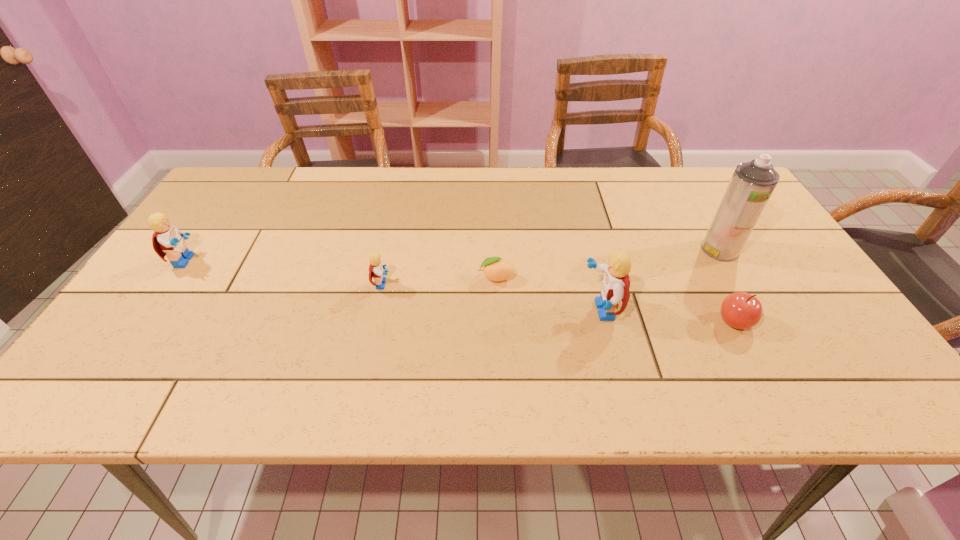
What are the coordinates of `object that is the fifth closest to the shortest Lego` in the screenshot? It's located at (752, 183).

I want to click on Lego object that ranks as the second closest to the shortest object, so click(x=376, y=268).

Select which Lego appears as the closest to the farthest Lego. Please provide its 2D coordinates. Your answer should be formatted as a tuple, i.e. [(x, y)], where the tuple contains the x and y coordinates of a point satisfying the conditions above.

[(376, 268)]

You are a GUI agent. You are given a task and a screenshot of the screen. Output one action in this format:
    pyautogui.click(x=<x>, y=<y>)
    Task: Click on the free point that satisfies the following two spatial constraints: 1. with leaves positioned above the lemon; 2. on the back side of the apple
    
    Given the screenshot: What is the action you would take?
    pyautogui.click(x=497, y=321)

At what (x,y) coordinates should I click in order to perform the action: click on free space that satisfies the following two spatial constraints: 1. on the front-facing side of the third object from right to left; 2. on the back side of the apple. Please return your answer as a coordinate pair (x, y). Image resolution: width=960 pixels, height=540 pixels. Looking at the image, I should click on (605, 321).

Locate an element on the screen. vacant space that satisfies the following two spatial constraints: 1. on the front-facing side of the apple; 2. on the left side of the rightmost Lego is located at coordinates (605, 321).

Image resolution: width=960 pixels, height=540 pixels. In order to click on vacant space that satisfies the following two spatial constraints: 1. with leaves positioned above the apple; 2. on the right side of the shortest object in this screenshot , I will do `click(497, 321)`.

Where is `vacant space that satisfies the following two spatial constraints: 1. on the front-facing side of the apple; 2. on the left side of the nearest Lego`? The image size is (960, 540). vacant space that satisfies the following two spatial constraints: 1. on the front-facing side of the apple; 2. on the left side of the nearest Lego is located at coordinates (605, 321).

Locate an element on the screen. This screenshot has height=540, width=960. vacant region that satisfies the following two spatial constraints: 1. on the front side of the aerosol can; 2. with leaves positioned above the lemon is located at coordinates (735, 277).